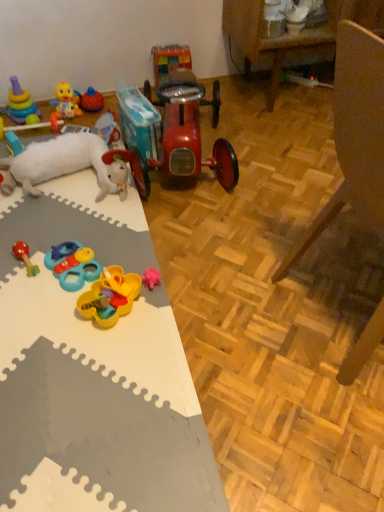
Locate an element on the screen. Image resolution: width=384 pixels, height=512 pixels. free spot behind yellow plastic toy at center, positioned as the 9th toy in left-to-right order is located at coordinates (131, 252).